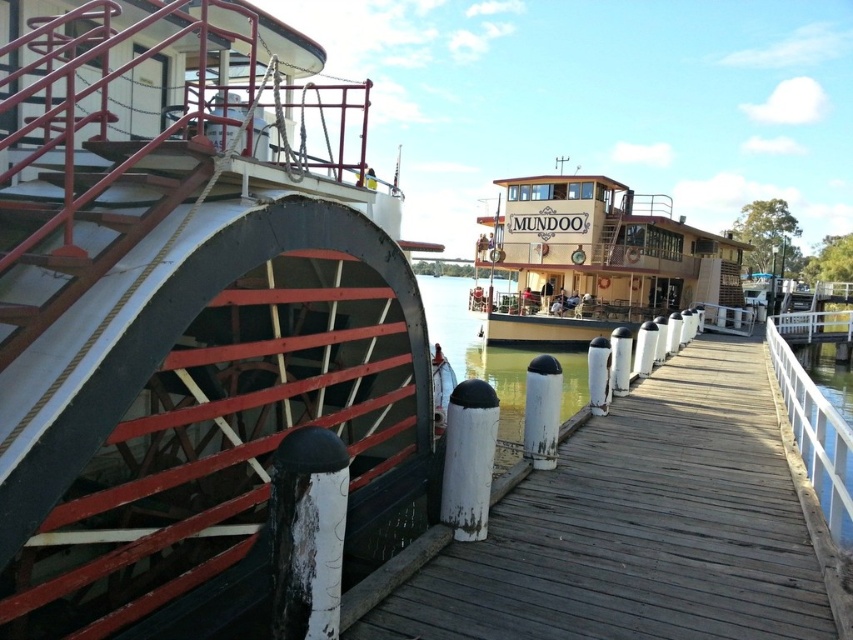
You are standing on the wooden dock at center and want to reach the wooden paddlewheel at left. Which direction should you walk to get there?

You should walk to the left side of the wooden dock at center to reach the wooden paddlewheel at left since it is positioned on the left side of wooden dock at center.

You are standing on the wooden dock at center and want to board the wooden polished boat at center. Based on the scene description, can you tell me which one is lower in height?

The wooden dock at center has a lesser height compared to the wooden polished boat at center, so the wooden dock at center is lower in height.